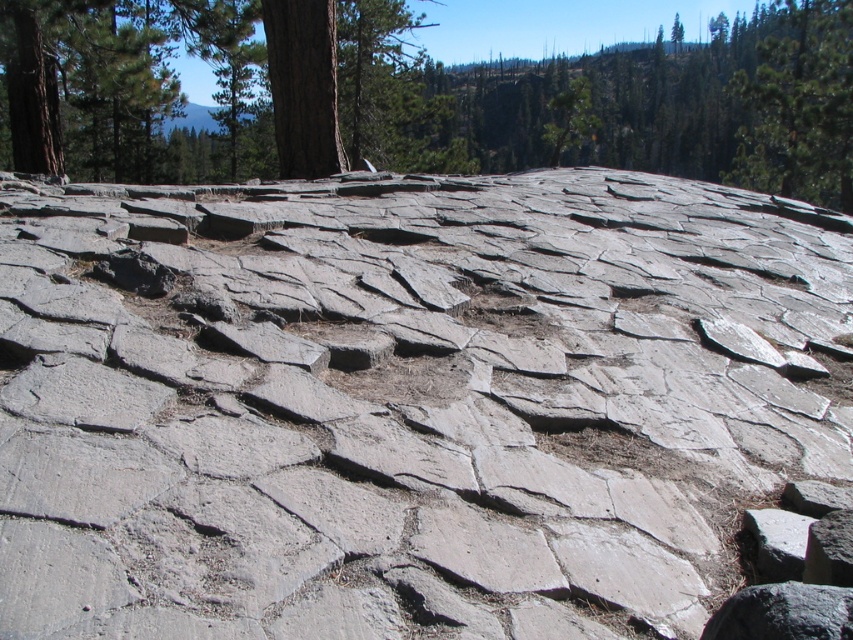
Does gray rough stone at center appear under brown rough tree at upper center?

Correct, gray rough stone at center is located below brown rough tree at upper center.

Can you confirm if gray rough stone at center is positioned to the left of brown rough tree at upper center?

No, gray rough stone at center is not to the left of brown rough tree at upper center.

Does point (227, 216) come farther from viewer compared to point (78, 90)?

No, (227, 216) is in front of (78, 90).

Find the location of a particular element. gray rough stone at center is located at coordinates (404, 401).

Which is in front, point (468, 106) or point (744, 168)?

Positioned in front is point (744, 168).

Does brown rough tree at upper center appear on the right side of green textured tree at upper right?

Incorrect, brown rough tree at upper center is not on the right side of green textured tree at upper right.

Is point (759, 138) more distant than point (749, 156)?

No, (759, 138) is in front of (749, 156).

The image size is (853, 640). In order to click on brown rough tree at upper center in this screenshot , I will do `click(614, 100)`.

Who is higher up, gray rough stone at center or green textured tree at upper right?

Positioned higher is green textured tree at upper right.

Is gray rough stone at center smaller than green textured tree at upper right?

Yes.

Measure the distance between point (618,339) and camera.

They are 12.81 feet apart.

The height and width of the screenshot is (640, 853). Find the location of `gray rough stone at center`. gray rough stone at center is located at coordinates (404, 401).